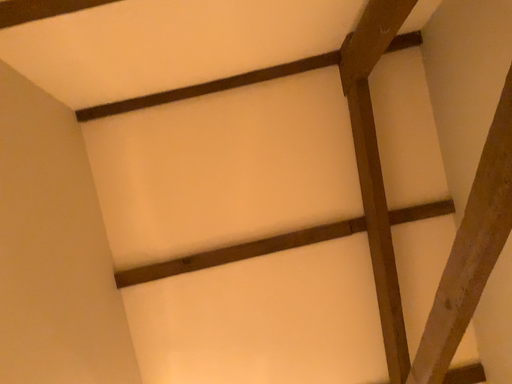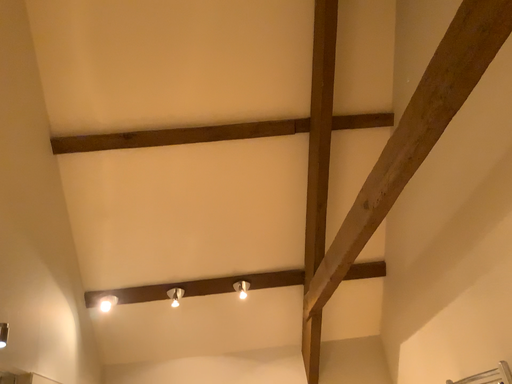
Question: How did the camera likely rotate when shooting the video?

Choices:
 (A) rotated downward
 (B) rotated upward

Answer: (A)